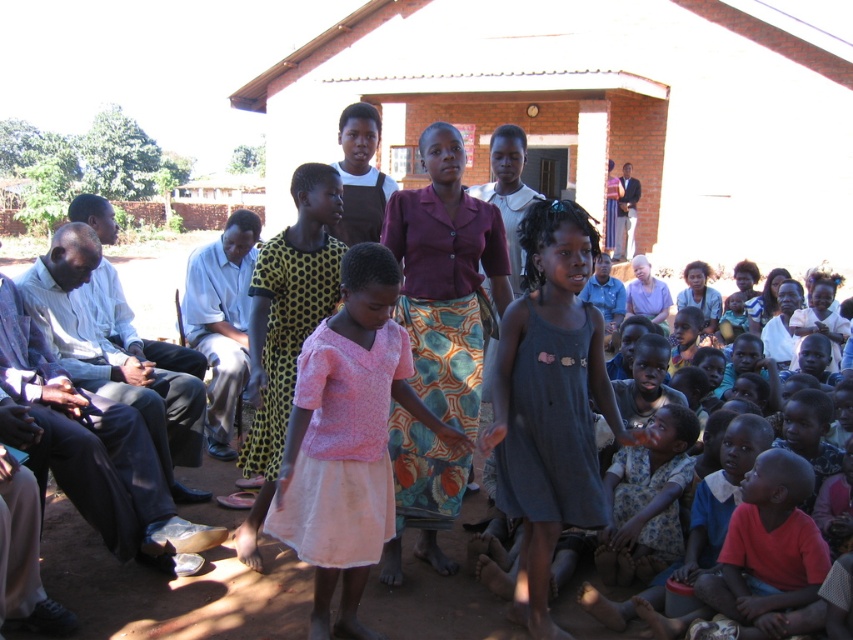
Can you confirm if pink fabric dress at center is wider than light brown fabric shirt at left?

In fact, pink fabric dress at center might be narrower than light brown fabric shirt at left.

Who is more forward, (x=358, y=632) or (x=102, y=305)?

Positioned in front is point (x=358, y=632).

What do you see at coordinates (347, 438) in the screenshot? The image size is (853, 640). I see `pink fabric dress at center` at bounding box center [347, 438].

Where is `pink fabric dress at center`? This screenshot has height=640, width=853. pink fabric dress at center is located at coordinates (347, 438).

Is pink fabric dress at center smaller than white shirt at left?

Yes, pink fabric dress at center is smaller than white shirt at left.

Is pink fabric dress at center below white shirt at left?

Correct, pink fabric dress at center is located below white shirt at left.

Which is behind, point (314, 387) or point (248, 230)?

Point (248, 230)

Image resolution: width=853 pixels, height=640 pixels. Identify the location of pink fabric dress at center. (347, 438).

Is dark gray cotton dress at center above light brown fabric shirt at left?

Actually, dark gray cotton dress at center is below light brown fabric shirt at left.

This screenshot has height=640, width=853. Find the location of `dark gray cotton dress at center`. dark gray cotton dress at center is located at coordinates (550, 403).

Who is more forward, (x=540, y=508) or (x=166, y=365)?

Point (x=540, y=508) is more forward.

I want to click on dark gray cotton dress at center, so click(x=550, y=403).